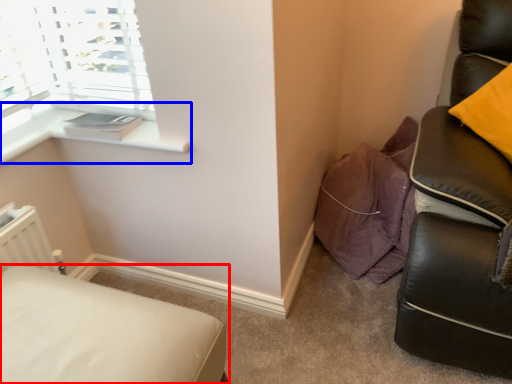
Question: Which object is further to the camera taking this photo, furniture (highlighted by a red box) or window sill (highlighted by a blue box)?

Choices:
 (A) furniture
 (B) window sill

Answer: (B)